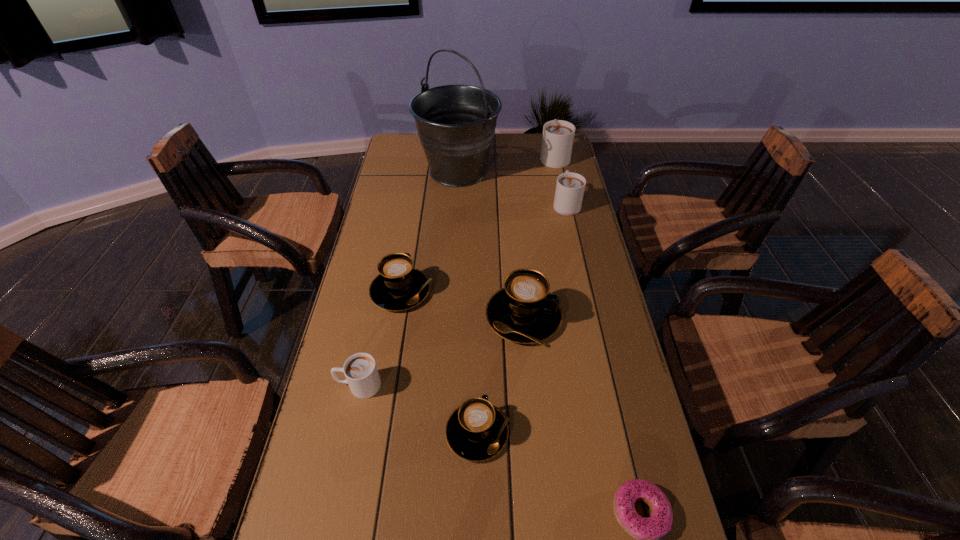
Where is `the seventh farthest object`? The height and width of the screenshot is (540, 960). the seventh farthest object is located at coordinates point(476,431).

Image resolution: width=960 pixels, height=540 pixels. In order to click on the nearest cappuccino in this screenshot , I will do `click(476, 431)`.

Where is `vacant space located 0.100m on the front of the bucket`? The width and height of the screenshot is (960, 540). vacant space located 0.100m on the front of the bucket is located at coordinates (456, 212).

The width and height of the screenshot is (960, 540). Identify the location of free region located on the side with the handle of the farthest white cappuccino. (549, 135).

Where is `vacant space situated on the side with the handle of the farthest white cappuccino`? vacant space situated on the side with the handle of the farthest white cappuccino is located at coordinates (549, 132).

Locate an element on the screen. The width and height of the screenshot is (960, 540). free location located on the right of the biggest black cappuccino is located at coordinates (590, 317).

This screenshot has height=540, width=960. What are the coordinates of `free space located on the side with the handle of the second biggest white cappuccino` in the screenshot? It's located at (551, 138).

Locate an element on the screen. Image resolution: width=960 pixels, height=540 pixels. free space located 0.260m on the side with the handle of the second biggest white cappuccino is located at coordinates (555, 155).

Image resolution: width=960 pixels, height=540 pixels. What are the coordinates of `blank space located on the side with the handle of the second biggest white cappuccino` in the screenshot? It's located at (561, 178).

At what (x,y) coordinates should I click in order to perform the action: click on free spot located on the back of the second biggest black cappuccino. Please return your answer as a coordinate pair (x, y). This screenshot has width=960, height=540. Looking at the image, I should click on (x=412, y=224).